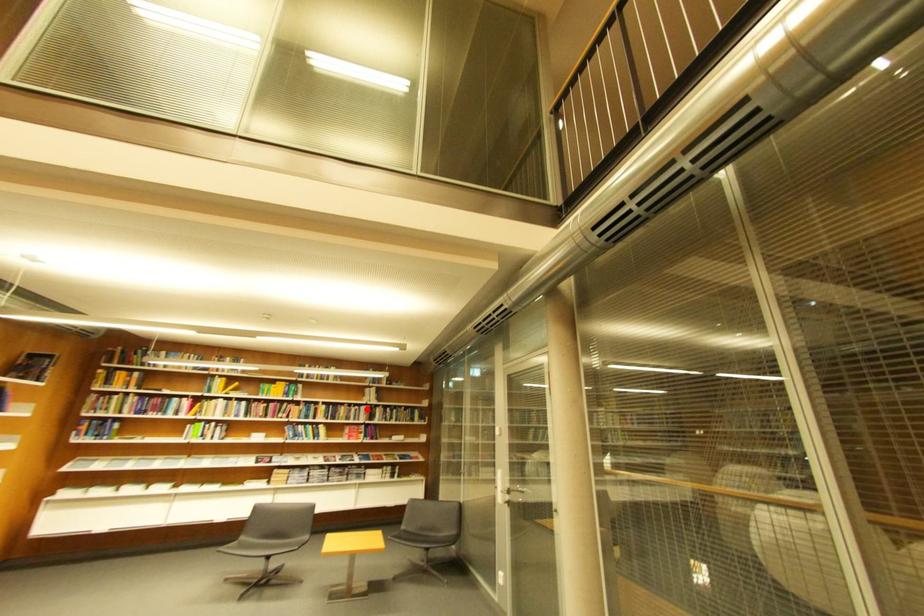
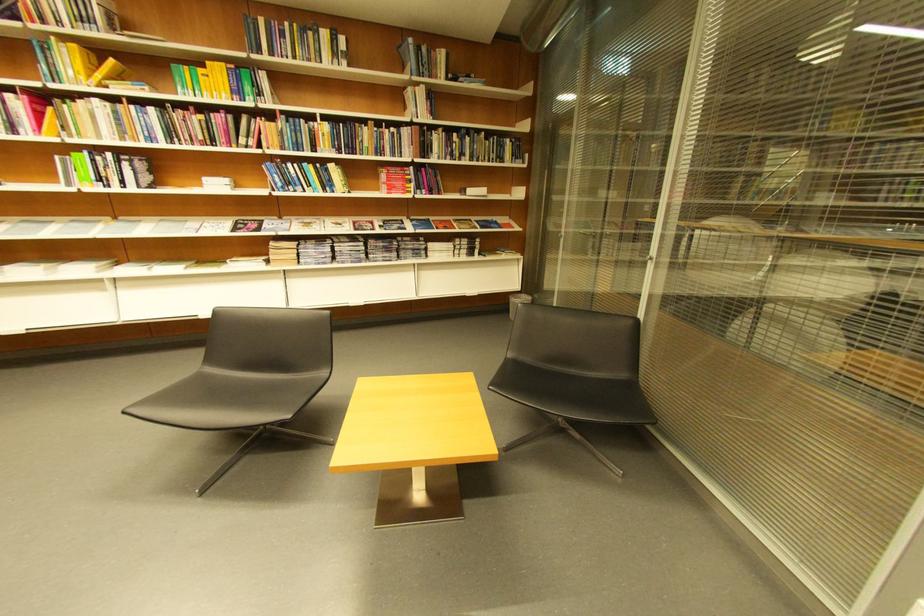
Question: I am providing you with two images of the same scene from different viewpoints. Image1 has a red point marked. In image2, the corresponding 3D location appears at what relative position? Reply with the corresponding letter.

Choices:
 (A) Closer
 (B) Farther

Answer: (A)